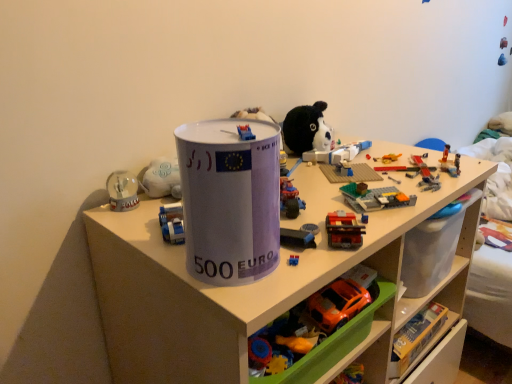
Locate an element on the screen. This screenshot has width=512, height=384. free space to the left of brick-like plastic train at center-right, the second toy positioned from the top is located at coordinates (279, 248).